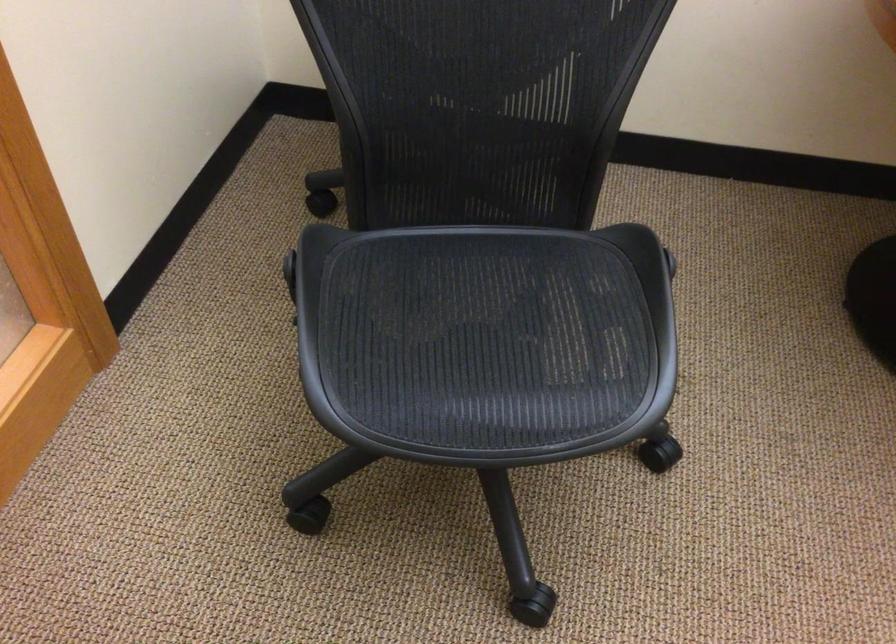
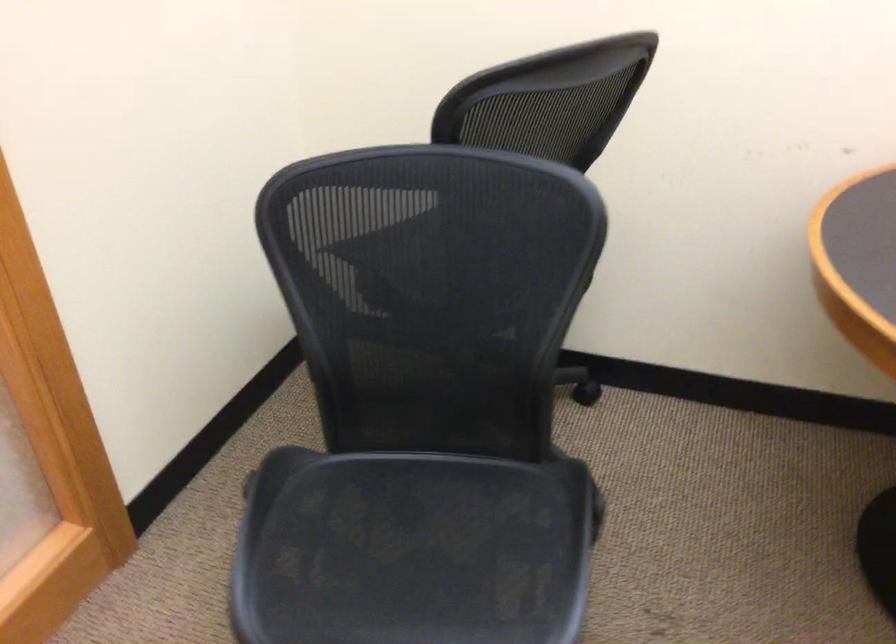
The images are taken continuously from a first-person perspective. In which direction are you moving?

The cameraman walked toward right, backward.